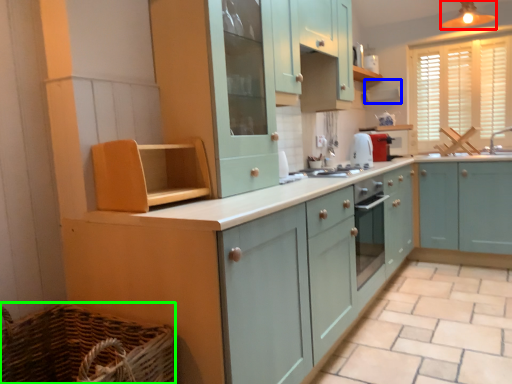
Question: Estimate the real-world distances between objects in this image. Which object is closer to light fixture (highlighted by a red box), exhaust hood (highlighted by a blue box) or basket (highlighted by a green box)?

Choices:
 (A) exhaust hood
 (B) basket

Answer: (A)